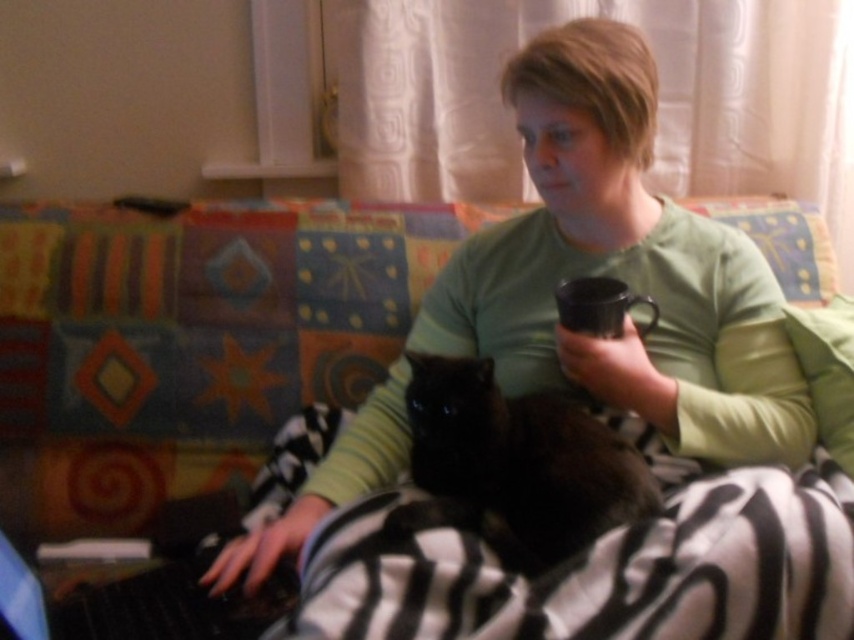
You are a photographer trying to capture a closeup of the green soft shirt at center and the black fur cat at center. Since you want to focus on both subjects, which one should you adjust your camera lens to focus on first considering their sizes?

The green soft shirt at center is much taller than the black fur cat at center, so you should focus on the green soft shirt at center first as it is larger and requires more attention in the frame.

You are a designer trying to place a small plant in the scene. The plant must be placed exactly at the point marked by the coordinates point (619,268). What object will the plant be placed on top of?

The point (619,268) marks the green soft shirt at center, so placing the plant there would put it on top of the green soft shirt at center.

You are a photographer taking a picture of the scene. You notice the green soft shirt at center and the black fur cat at center. Which object is closer to your camera lens?

The green soft shirt at center is closer to the camera lens because it is further to the viewer than the black fur cat at center.